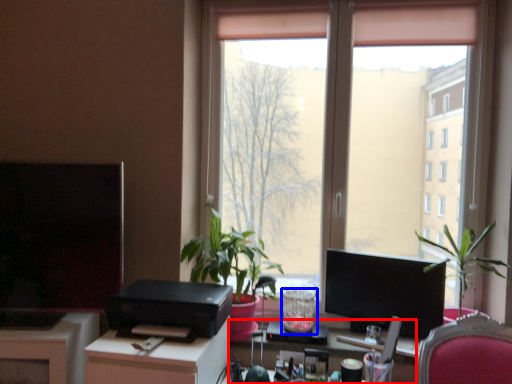
Question: Which point is closer to the camera, computer desk (highlighted by a red box) or glass vase (highlighted by a blue box)?

Choices:
 (A) computer desk
 (B) glass vase

Answer: (A)